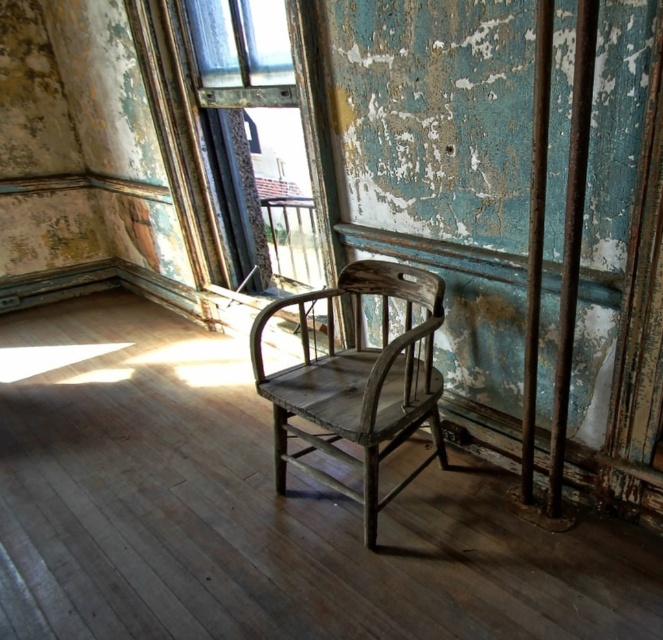
You are an interior designer assessing the room. You notice the wooden frame at center and the weathered wood chair at center. Which object has a greater height?

The wooden frame at center is taller than the weathered wood chair at center according to the description.

You are an interior designer planning to place a new rectangular table between the wooden frame at center and the weathered wood chair at center. To ensure the table fits, you need to know which object is wider. Which one is wider?

The wooden frame at center is wider than the weathered wood chair at center according to the description provided.

You are a painter standing in the room. You need to move a ladder from the wooden frame at center to the weathered wood chair at center. Can you move the ladder without it hitting anything in between?

The wooden frame at center is 29.84 inches away from the weathered wood chair at center. Since the ladder is likely shorter than this distance when folded, you can move it without hitting anything.